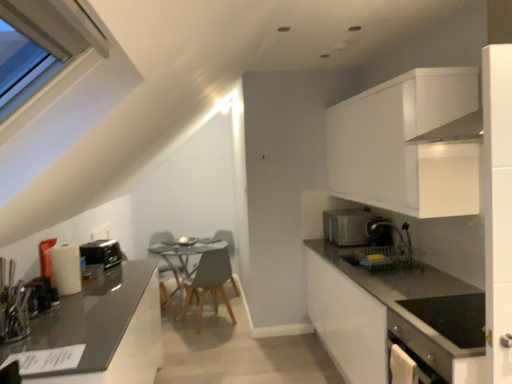
Question: Is shiny dark gray countertop at left, which appears as the second countertop when viewed from the right, taller than wooden chair at center?

Choices:
 (A) no
 (B) yes

Answer: (B)

Question: From the image's perspective, is shiny dark gray countertop at left, which ranks as the first countertop in left-to-right order, above wooden chair at center?

Choices:
 (A) yes
 (B) no

Answer: (B)

Question: Is shiny dark gray countertop at left, which ranks as the first countertop in left-to-right order, aimed at wooden chair at center?

Choices:
 (A) no
 (B) yes

Answer: (A)

Question: Is shiny dark gray countertop at left, which appears as the second countertop when viewed from the right, not close to wooden chair at center?

Choices:
 (A) yes
 (B) no

Answer: (A)

Question: From the image's perspective, is shiny dark gray countertop at left, which appears as the second countertop when viewed from the right, beneath wooden chair at center?

Choices:
 (A) no
 (B) yes

Answer: (B)

Question: Looking at their shapes, would you say black plastic toaster at left, which is counted as the 2th appliance, starting from the front, is wider or thinner than satin black coffee machine at right?

Choices:
 (A) wide
 (B) thin

Answer: (A)

Question: From their relative heights in the image, would you say black plastic toaster at left, which is counted as the first appliance, starting from the back, is taller or shorter than satin black coffee machine at right?

Choices:
 (A) short
 (B) tall

Answer: (A)

Question: Considering the relative positions of black plastic toaster at left, which is counted as the first appliance, starting from the back, and satin black coffee machine at right in the image provided, is black plastic toaster at left, which is counted as the first appliance, starting from the back, to the left or to the right of satin black coffee machine at right?

Choices:
 (A) left
 (B) right

Answer: (A)

Question: Is black plastic toaster at left, which is counted as the 2th appliance, starting from the front, inside the boundaries of satin black coffee machine at right, or outside?

Choices:
 (A) inside
 (B) outside

Answer: (B)

Question: From the image's perspective, is shiny dark gray countertop at left, which ranks as the first countertop in left-to-right order, located above or below transparent glass table at center?

Choices:
 (A) below
 (B) above

Answer: (A)

Question: From their relative heights in the image, would you say shiny dark gray countertop at left, which ranks as the first countertop in left-to-right order, is taller or shorter than transparent glass table at center?

Choices:
 (A) tall
 (B) short

Answer: (A)

Question: Based on their positions, is shiny dark gray countertop at left, which ranks as the first countertop in left-to-right order, located to the left or right of transparent glass table at center?

Choices:
 (A) left
 (B) right

Answer: (A)

Question: In the image, is shiny dark gray countertop at left, which ranks as the first countertop in left-to-right order, positioned in front of or behind transparent glass table at center?

Choices:
 (A) front
 (B) behind

Answer: (A)

Question: From the image's perspective, is matte gray chair at center located above or below shiny dark gray countertop at left, which appears as the second countertop when viewed from the right?

Choices:
 (A) above
 (B) below

Answer: (A)

Question: From a real-world perspective, is matte gray chair at center physically located above or below shiny dark gray countertop at left, which ranks as the first countertop in left-to-right order?

Choices:
 (A) below
 (B) above

Answer: (A)